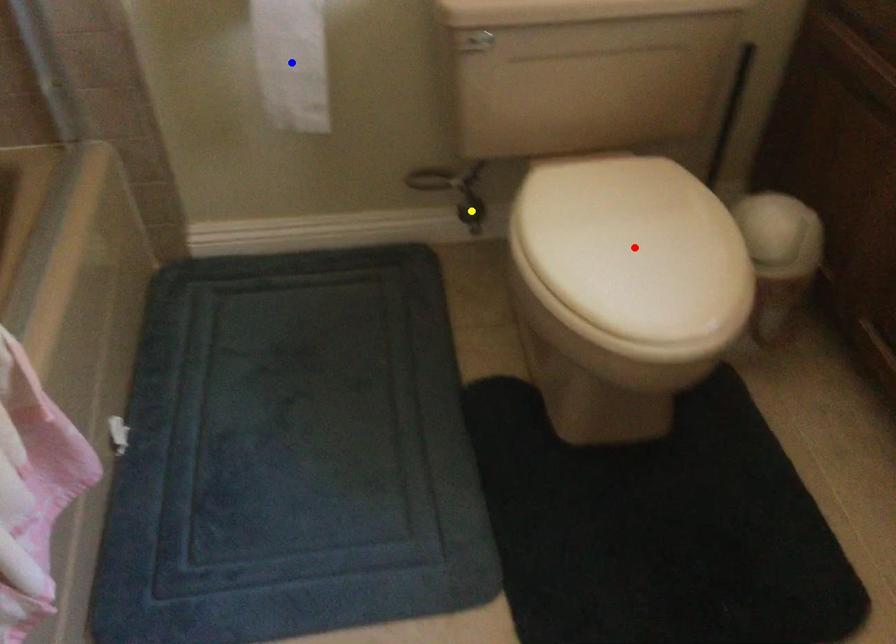
Order these from nearest to farthest:
- blue point
- yellow point
- red point

red point
blue point
yellow point